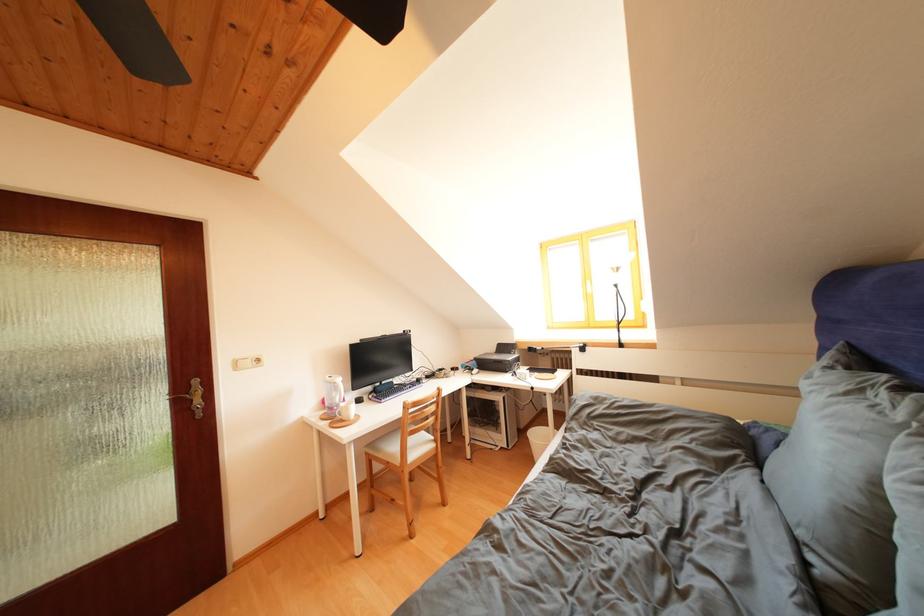
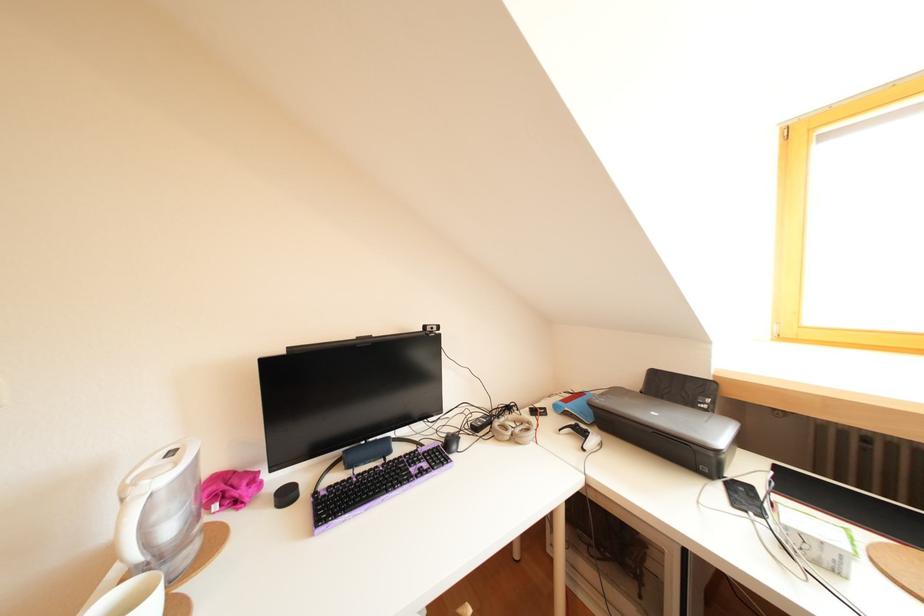
Find the pixel in the second image that matches pixel 448 376 in the first image.

(516, 413)